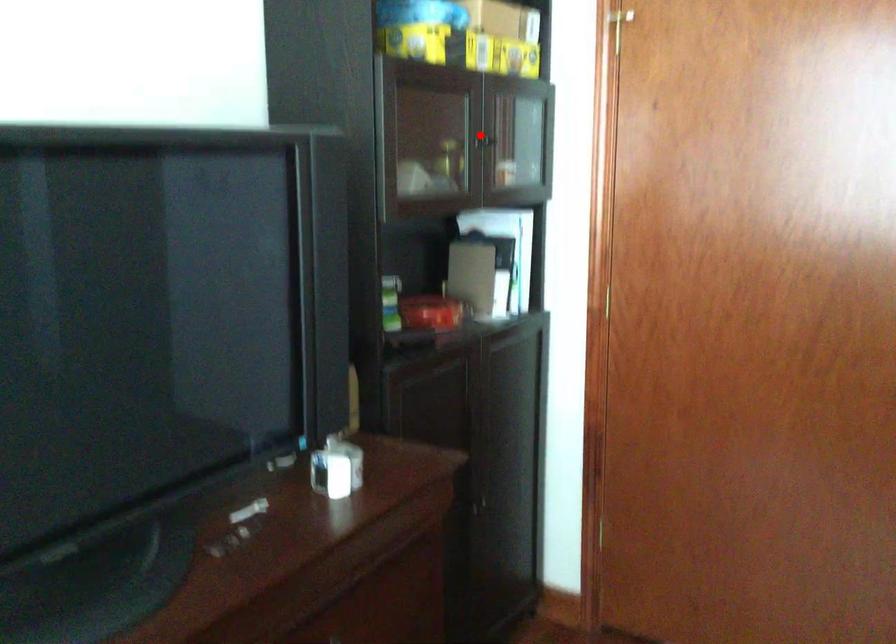
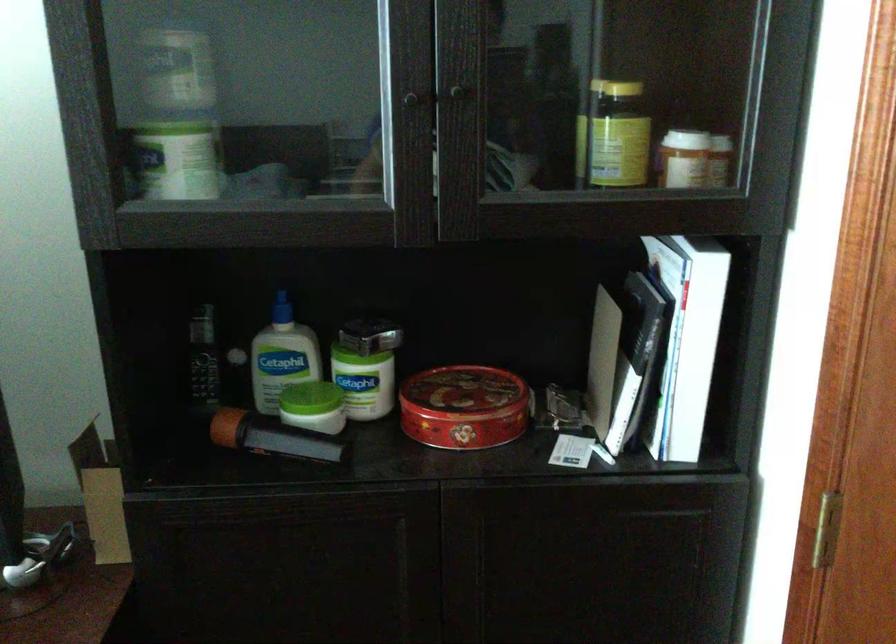
Where in the second image is the point corresponding to the highlighted location from the first image?

(409, 93)